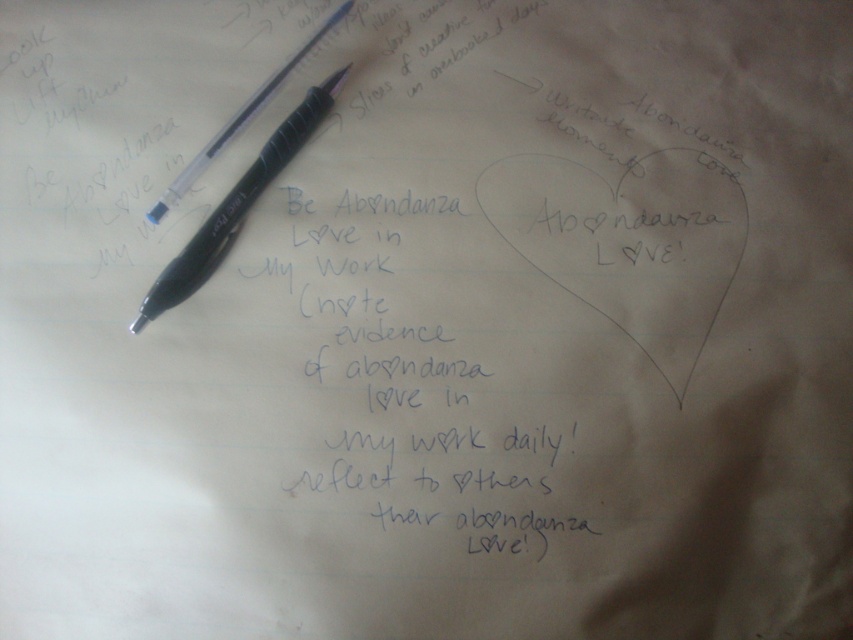
You are an artist trying to place a 2.5 inch ruler between the black plastic pen at upper left and the matte black pen at upper left. Will the ruler fit between them without overlapping either pen?

The distance between the black plastic pen at upper left and the matte black pen at upper left is 1.99 inches. Since the ruler is 2.5 inches long, it will not fit between them without overlapping as the space is smaller than the ruler.

You are organizing a stationery set and need to place both the black plastic pen at upper left and the matte black pen at upper left into a narrow pen holder. Based on their widths, which pen might not fit if the holder has limited space?

The black plastic pen at upper left might not fit into the narrow pen holder since it is wider than the matte black pen at upper left according to the description.